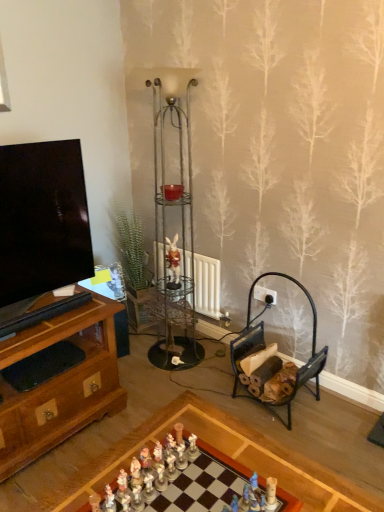
Question: Can you confirm if matte glass candle holder at center is shorter than black metal firewood rack at lower right?

Choices:
 (A) yes
 (B) no

Answer: (A)

Question: Is matte glass candle holder at center further to camera compared to black metal firewood rack at lower right?

Choices:
 (A) yes
 (B) no

Answer: (A)

Question: Is matte glass candle holder at center located outside black metal firewood rack at lower right?

Choices:
 (A) no
 (B) yes

Answer: (B)

Question: From a real-world perspective, is matte glass candle holder at center beneath black metal firewood rack at lower right?

Choices:
 (A) yes
 (B) no

Answer: (B)

Question: Is matte glass candle holder at center positioned far away from black metal firewood rack at lower right?

Choices:
 (A) no
 (B) yes

Answer: (A)

Question: Considering the relative sizes of matte glass candle holder at center and black metal firewood rack at lower right in the image provided, is matte glass candle holder at center wider than black metal firewood rack at lower right?

Choices:
 (A) no
 (B) yes

Answer: (A)

Question: From a real-world perspective, is metallic wire shelving unit at center physically above white porcelain figurines at center, which ranks as the second toy in left-to-right order?

Choices:
 (A) yes
 (B) no

Answer: (A)

Question: From a real-world perspective, is metallic wire shelving unit at center beneath white porcelain figurines at center, which ranks as the second toy in left-to-right order?

Choices:
 (A) yes
 (B) no

Answer: (B)

Question: Is metallic wire shelving unit at center not close to white porcelain figurines at center, which ranks as the second toy in left-to-right order?

Choices:
 (A) no
 (B) yes

Answer: (B)

Question: Does metallic wire shelving unit at center have a lesser width compared to white porcelain figurines at center, positioned as the second toy in right-to-left order?

Choices:
 (A) yes
 (B) no

Answer: (B)

Question: Is metallic wire shelving unit at center behind white porcelain figurines at center, which ranks as the second toy in left-to-right order?

Choices:
 (A) no
 (B) yes

Answer: (B)

Question: Does metallic wire shelving unit at center have a larger size compared to white porcelain figurines at center, which ranks as the second toy in left-to-right order?

Choices:
 (A) no
 (B) yes

Answer: (B)

Question: Considering the relative sizes of matte brown figurine at center and white porcelain figurines at center, which ranks as the second toy in left-to-right order, in the image provided, is matte brown figurine at center taller than white porcelain figurines at center, which ranks as the second toy in left-to-right order,?

Choices:
 (A) yes
 (B) no

Answer: (A)